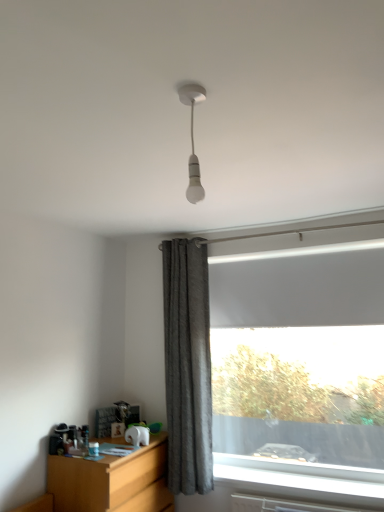
The height and width of the screenshot is (512, 384). In order to click on gray textured curtain at center in this screenshot , I will do `click(187, 366)`.

Find the location of `gray textured curtain at center`. gray textured curtain at center is located at coordinates tap(187, 366).

From a real-world perspective, who is located lower, white matte bulb at upper center or gray textured curtain at center?

gray textured curtain at center.

Between white matte bulb at upper center and gray textured curtain at center, which one has less height?

With less height is white matte bulb at upper center.

Between white matte bulb at upper center and gray textured curtain at center, which one has smaller size?

white matte bulb at upper center.

Is point (179, 97) behind point (206, 460)?

That is False.

This screenshot has height=512, width=384. What are the coordinates of `desk that is on the left side of gray textured curtain at center` in the screenshot? It's located at (112, 481).

From a real-world perspective, which is physically below, gray textured curtain at center or wooden at left?

From a 3D spatial view, wooden at left is below.

Considering the relative sizes of gray textured curtain at center and wooden at left in the image provided, is gray textured curtain at center thinner than wooden at left?

Indeed, gray textured curtain at center has a lesser width compared to wooden at left.

Considering the positions of points (178, 436) and (145, 504), is point (178, 436) closer to camera compared to point (145, 504)?

No, it is not.

From the image's perspective, who appears lower, wooden at left or gray textured curtain at center?

From the image's view, wooden at left is below.

From a real-world perspective, between wooden at left and gray textured curtain at center, who is vertically lower?

wooden at left is physically lower.

Which is correct: wooden at left is inside gray textured curtain at center, or outside of it?

wooden at left is spatially situated outside gray textured curtain at center.

Image resolution: width=384 pixels, height=512 pixels. I want to click on curtain that is under the white matte bulb at upper center (from a real-world perspective), so click(187, 366).

Is gray textured curtain at center directly adjacent to white matte bulb at upper center?

gray textured curtain at center and white matte bulb at upper center are clearly separated.

Would you say gray textured curtain at center is inside or outside white matte bulb at upper center?

gray textured curtain at center is outside white matte bulb at upper center.

Considering their positions, is gray textured curtain at center located in front of or behind white matte bulb at upper center?

Visually, gray textured curtain at center is located behind white matte bulb at upper center.

Can you tell me how much wooden at left and white matte bulb at upper center differ in facing direction?

The angle between the facing direction of wooden at left and the facing direction of white matte bulb at upper center is 178 degrees.

Considering the positions of objects wooden at left and white matte bulb at upper center in the image provided, who is in front, wooden at left or white matte bulb at upper center?

white matte bulb at upper center is more forward.

From the image's perspective, which object appears higher, wooden at left or white matte bulb at upper center?

white matte bulb at upper center is shown above in the image.

Is wooden at left looking in the opposite direction of white matte bulb at upper center?

That's not correct — wooden at left is not looking away from white matte bulb at upper center.

Is white matte bulb at upper center next to wooden at left?

No, white matte bulb at upper center is not beside wooden at left.

Considering the sizes of objects white matte bulb at upper center and wooden at left in the image provided, who is thinner, white matte bulb at upper center or wooden at left?

With smaller width is white matte bulb at upper center.

From a real-world perspective, which object rests below the other?

From a 3D spatial view, wooden at left is below.

Where is `lamp on the right of gray textured curtain at center`? This screenshot has width=384, height=512. lamp on the right of gray textured curtain at center is located at coordinates click(192, 139).

Where is `curtain that appears behind the wooden at left`? The height and width of the screenshot is (512, 384). curtain that appears behind the wooden at left is located at coordinates coord(187,366).

From the image, which object appears to be farther from white matte bulb at upper center, wooden at left or gray textured curtain at center?

Based on the image, wooden at left appears to be further to white matte bulb at upper center.

Which object lies further to the anchor point wooden at left, white matte bulb at upper center or gray textured curtain at center?

Based on the image, white matte bulb at upper center appears to be further to wooden at left.

Looking at the image, which one is located further to gray textured curtain at center, white matte bulb at upper center or wooden at left?

white matte bulb at upper center lies further to gray textured curtain at center than the other object.

When comparing their distances from gray textured curtain at center, does wooden at left or white matte bulb at upper center seem closer?

wooden at left lies closer to gray textured curtain at center than the other object.

Looking at the image, which one is located closer to white matte bulb at upper center, gray textured curtain at center or wooden at left?

gray textured curtain at center is closer to white matte bulb at upper center.

Estimate the real-world distances between objects in this image. Which object is further from wooden at left, gray textured curtain at center or white matte bulb at upper center?

white matte bulb at upper center is positioned further to the anchor wooden at left.

In order to click on curtain between white matte bulb at upper center and wooden at left vertically in this screenshot , I will do `click(187, 366)`.